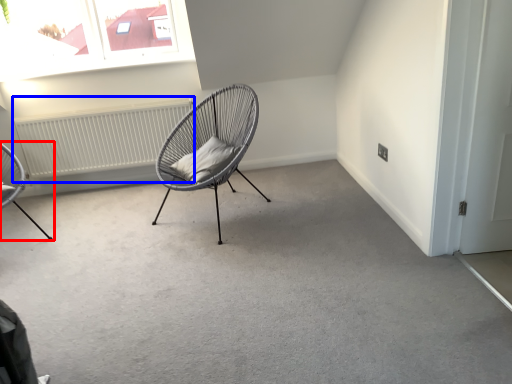
Question: Which of the following is the farthest to the observer, chair (highlighted by a red box) or radiator (highlighted by a blue box)?

Choices:
 (A) chair
 (B) radiator

Answer: (B)